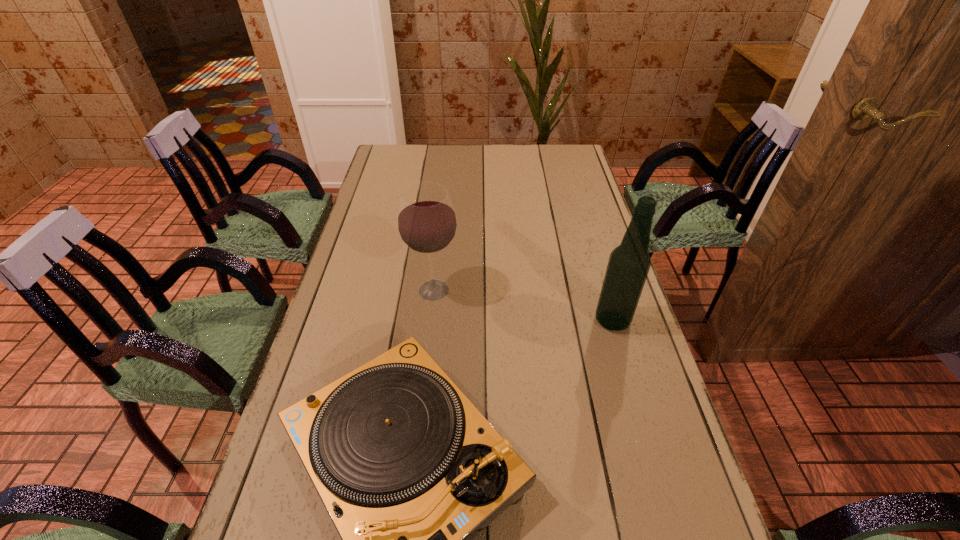
Locate an element on the screen. The image size is (960, 540). free area in between the rightmost object and the second shortest object is located at coordinates (523, 305).

What are the coordinates of `vacant area between the second tallest object and the rightmost object` in the screenshot? It's located at (523, 305).

Image resolution: width=960 pixels, height=540 pixels. Find the location of `vacant space in between the left alcohol and the rightmost object`. vacant space in between the left alcohol and the rightmost object is located at coordinates (523, 305).

Identify which object is the second closest to the record player. Please provide its 2D coordinates. Your answer should be formatted as a tuple, i.e. [(x, y)], where the tuple contains the x and y coordinates of a point satisfying the conditions above.

[(628, 266)]

Find the location of `the second closest object to the shorter alcohol`. the second closest object to the shorter alcohol is located at coordinates (628, 266).